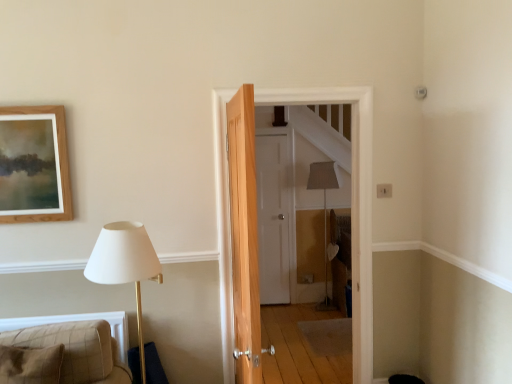
Question: Is wooden door at center, which is the second door from back to front, wider than white matte door at center, which appears as the 1th door when viewed from the back?

Choices:
 (A) yes
 (B) no

Answer: (A)

Question: From a real-world perspective, is wooden door at center, placed as the 1th door when sorted from front to back, positioned under white matte door at center, which is the second door in front-to-back order, based on gravity?

Choices:
 (A) no
 (B) yes

Answer: (A)

Question: Is wooden door at center, placed as the 1th door when sorted from front to back, facing away from white matte door at center, which is the second door in front-to-back order?

Choices:
 (A) no
 (B) yes

Answer: (B)

Question: Is white matte door at center, which is the second door in front-to-back order, completely or partially inside wooden door at center, which is the second door from back to front?

Choices:
 (A) no
 (B) yes

Answer: (A)

Question: Is wooden door at center, placed as the 1th door when sorted from front to back, in contact with white matte door at center, which is the second door in front-to-back order?

Choices:
 (A) no
 (B) yes

Answer: (A)

Question: From a real-world perspective, is wooden door at center, placed as the 1th door when sorted from front to back, above or below plaid fabric cushion at lower left?

Choices:
 (A) below
 (B) above

Answer: (B)

Question: Considering the positions of wooden door at center, placed as the 1th door when sorted from front to back, and plaid fabric cushion at lower left in the image, is wooden door at center, placed as the 1th door when sorted from front to back, taller or shorter than plaid fabric cushion at lower left?

Choices:
 (A) tall
 (B) short

Answer: (A)

Question: Is wooden door at center, placed as the 1th door when sorted from front to back, situated inside plaid fabric cushion at lower left or outside?

Choices:
 (A) outside
 (B) inside

Answer: (A)

Question: Is wooden door at center, placed as the 1th door when sorted from front to back, to the left or to the right of plaid fabric cushion at lower left in the image?

Choices:
 (A) left
 (B) right

Answer: (B)

Question: From their relative heights in the image, would you say plaid fabric cushion at lower left is taller or shorter than wooden door at center, which is the second door from back to front?

Choices:
 (A) tall
 (B) short

Answer: (B)

Question: Considering their positions, is plaid fabric cushion at lower left located in front of or behind wooden door at center, which is the second door from back to front?

Choices:
 (A) front
 (B) behind

Answer: (A)

Question: From the image's perspective, relative to wooden door at center, placed as the 1th door when sorted from front to back, is plaid fabric cushion at lower left above or below?

Choices:
 (A) below
 (B) above

Answer: (A)

Question: Is plaid fabric cushion at lower left wider or thinner than wooden door at center, which is the second door from back to front?

Choices:
 (A) thin
 (B) wide

Answer: (B)

Question: Looking at their shapes, would you say white matte door at center, which appears as the 1th door when viewed from the back, is wider or thinner than plaid fabric cushion at lower left?

Choices:
 (A) thin
 (B) wide

Answer: (A)

Question: Looking at the image, does white matte door at center, which is the second door in front-to-back order, seem bigger or smaller compared to plaid fabric cushion at lower left?

Choices:
 (A) small
 (B) big

Answer: (B)